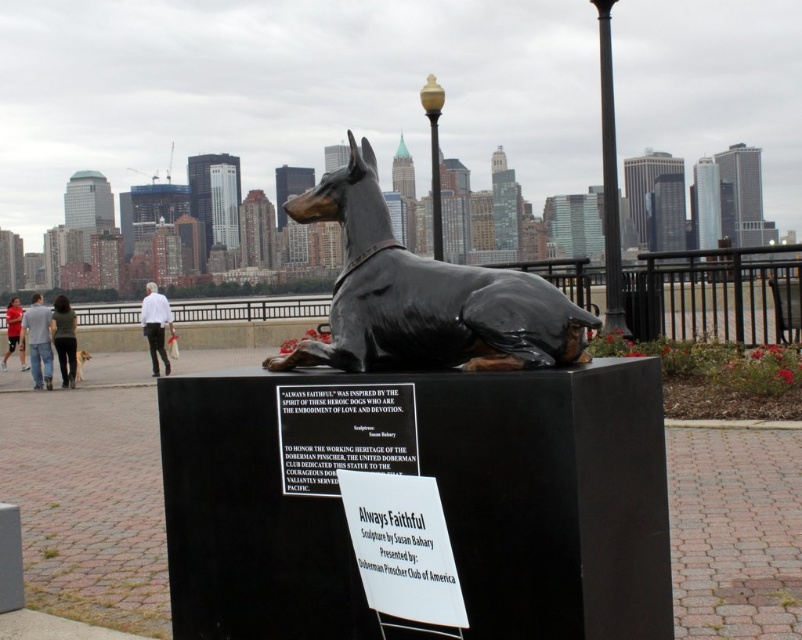
Is black glossy doberman at center wider than dark green jacket at center?

In fact, black glossy doberman at center might be narrower than dark green jacket at center.

Can you confirm if black glossy doberman at center is positioned above dark green jacket at center?

Indeed, black glossy doberman at center is positioned over dark green jacket at center.

Between point (371, 344) and point (67, 349), which one is positioned in front?

Point (371, 344) is in front.

Where is `black glossy doberman at center`? The height and width of the screenshot is (640, 802). black glossy doberman at center is located at coordinates (423, 296).

Measure the distance between white shirt at center and camera.

A distance of 114.24 feet exists between white shirt at center and camera.

Describe the element at coordinates (156, 324) in the screenshot. The image size is (802, 640). I see `white shirt at center` at that location.

At what (x,y) coordinates should I click in order to perform the action: click on white shirt at center. Please return your answer as a coordinate pair (x, y). The width and height of the screenshot is (802, 640). Looking at the image, I should click on (156, 324).

Is point (63, 337) positioned behind point (82, 364)?

No, (63, 337) is closer to viewer.

Between point (67, 365) and point (79, 374), which one is positioned behind?

The point (79, 374) is more distant.

Find the location of a particular element. The image size is (802, 640). dark green jacket at center is located at coordinates (63, 339).